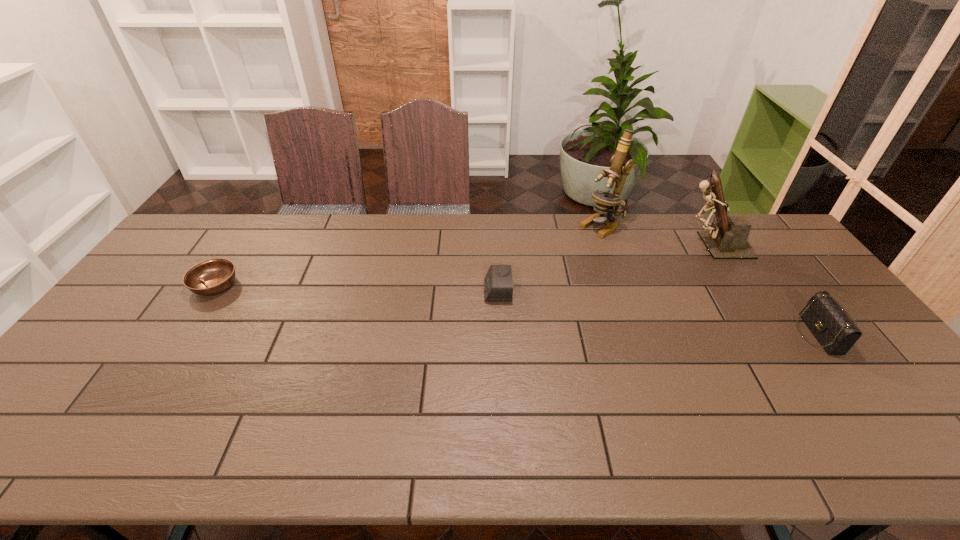
At what (x,y) coordinates should I click in order to perform the action: click on object that stands as the fourth closest to the leftmost object. Please return your answer as a coordinate pair (x, y). This screenshot has width=960, height=540. Looking at the image, I should click on (835, 331).

Identify which object is located as the fourth nearest to the third tallest object. Please provide its 2D coordinates. Your answer should be formatted as a tuple, i.e. [(x, y)], where the tuple contains the x and y coordinates of a point satisfying the conditions above.

[(212, 276)]